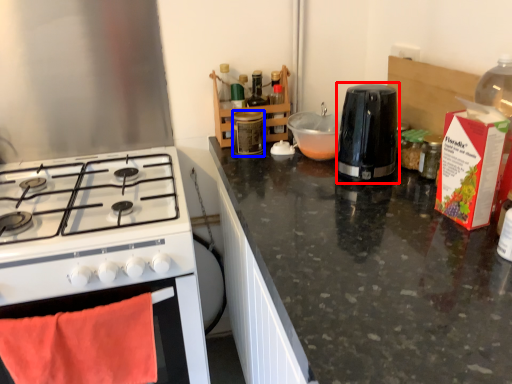
Question: Which object is closer to the camera taking this photo, kitchen appliance (highlighted by a red box) or bottle (highlighted by a blue box)?

Choices:
 (A) kitchen appliance
 (B) bottle

Answer: (A)